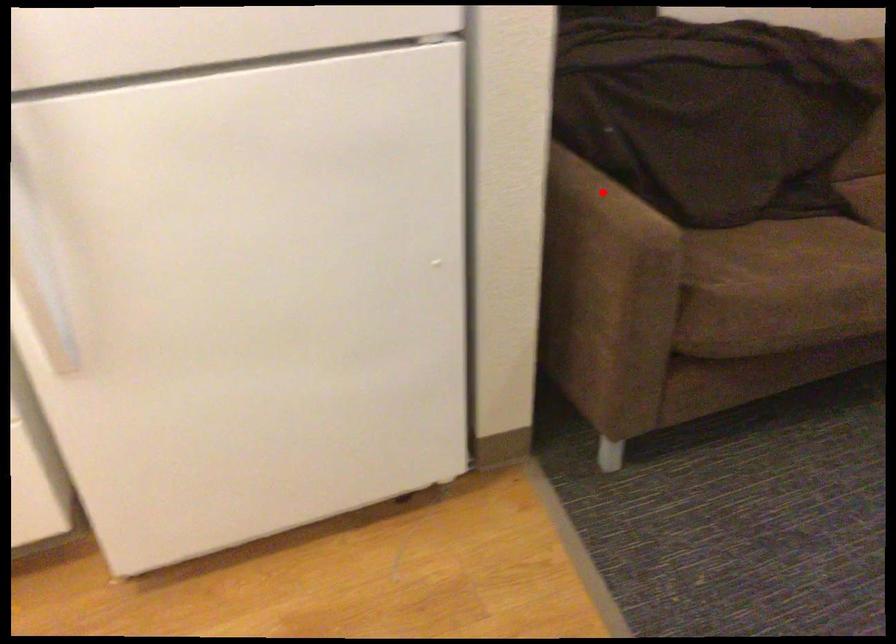
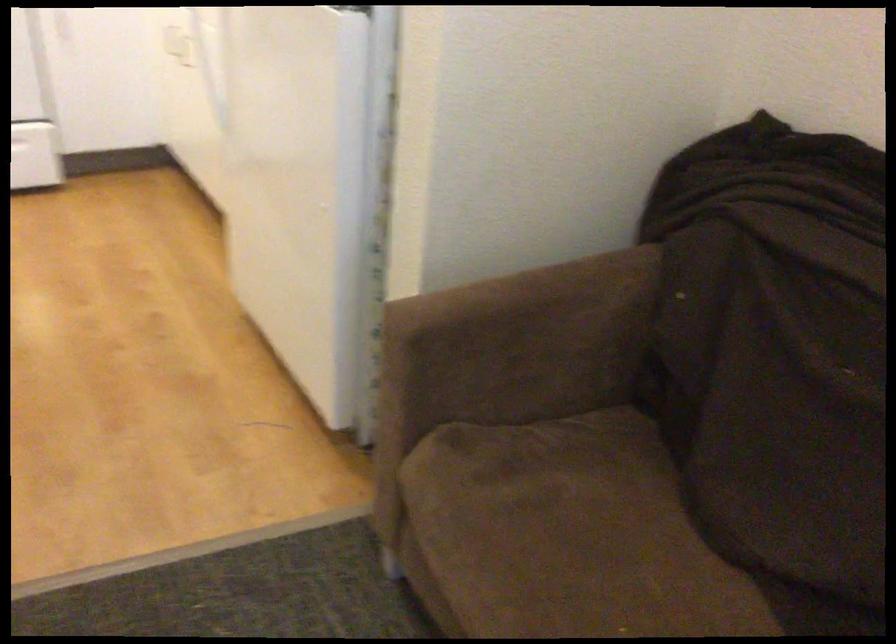
Find the pixel in the second image that matches the highlighted location in the first image.

(533, 310)